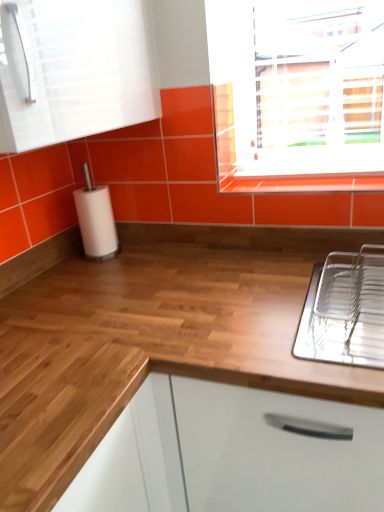
Question: Is white glossy cabinet at upper left taller or shorter than wooden at center?

Choices:
 (A) short
 (B) tall

Answer: (A)

Question: Is white glossy cabinet at upper left spatially inside wooden at center, or outside of it?

Choices:
 (A) inside
 (B) outside

Answer: (B)

Question: Based on their relative distances, which object is farther from the clear plastic dish rack at right?

Choices:
 (A) wooden at center
 (B) white glossy cabinet at upper left
 (C) white matte paper towel at left
 (D) glossy orange tile at upper center

Answer: (C)

Question: Which object is positioned farthest from the glossy orange tile at upper center?

Choices:
 (A) wooden at center
 (B) white matte paper towel at left
 (C) white glossy cabinet at upper left
 (D) clear plastic dish rack at right

Answer: (C)